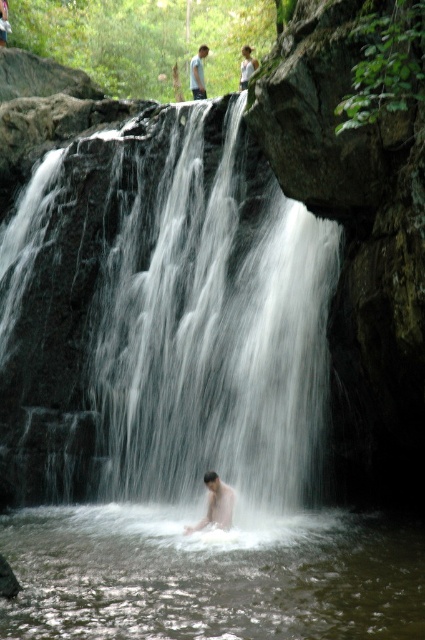
You are standing at the edge of the clear water at center and want to take a photo of the waterfall. If your camera can focus on objects up to 15 meters away, will it be able to capture the waterfall clearly?

The distance between the clear water at center and the camera is 13.70 meters, which is within the camera focus range of 15 meters. Therefore, the camera can capture the waterfall clearly.

You are a photographer planning to capture a portrait of the smooth skin man at center while ensuring the clear water at center is visible in the background. Based on their positions, which side of the man should you position yourself to frame both elements effectively?

To frame both the smooth skin man at center and the clear water at center effectively, you should position yourself to the right side of the man. This allows the clear water at center, which is on the man s left, to remain visible in the background.